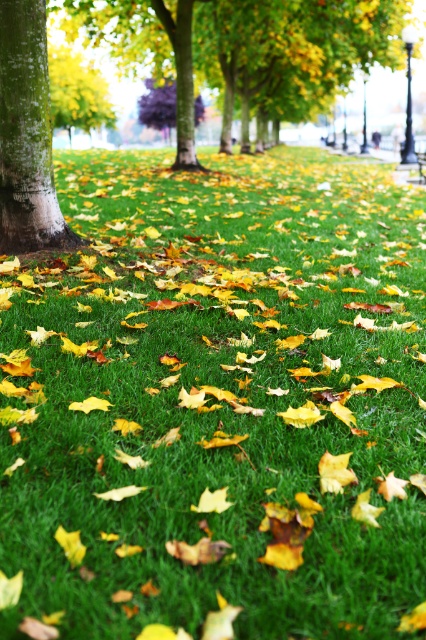
You are standing in the park and see the green rough bark tree at center and the smooth white tree trunk at left. Which tree is closer to the ground?

The green rough bark tree at center is closer to the ground because it is positioned below the smooth white tree trunk at left.

Based on the scene description, where is the smooth white tree trunk at left located in terms of its 2D coordinates?

The smooth white tree trunk at left is located at the 2D coordinates of point (26, 134).

You are a painter setting up an easel in the park. You want to paint both the smooth white tree trunk at left and the purple smooth tree at center. Which tree trunk is wider?

The smooth white tree trunk at left might be wider than the purple smooth tree at center according to the description.